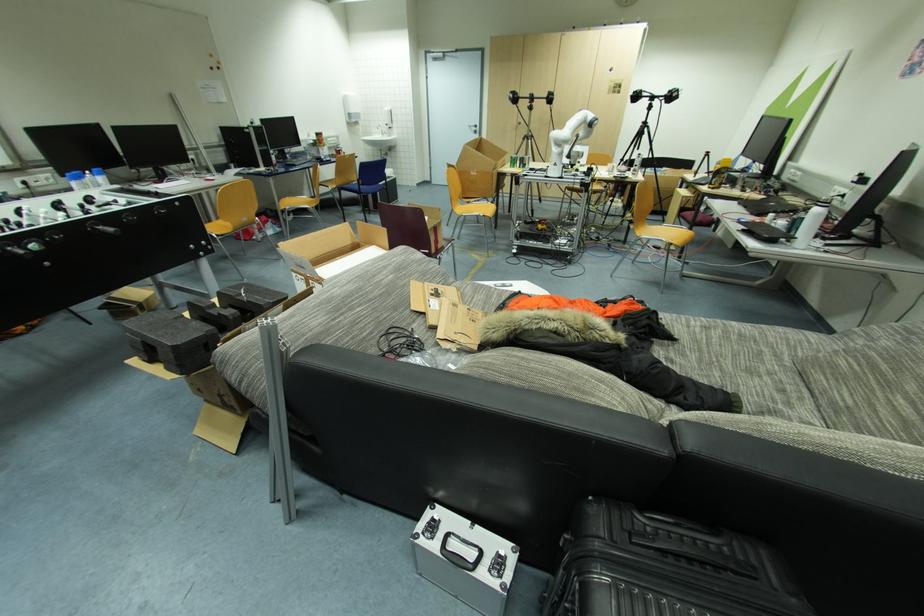
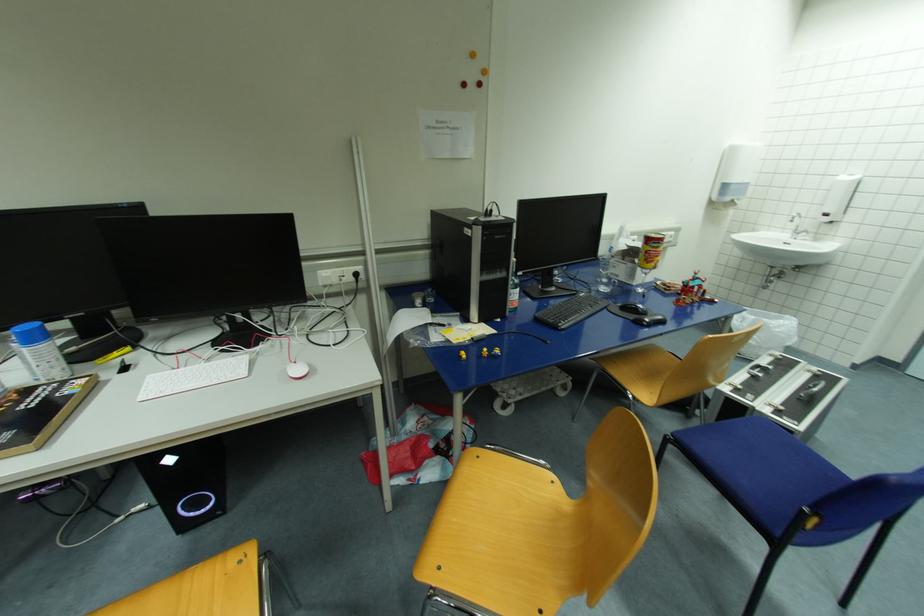
In the second image, find the point that corresponds to point 322,136 in the first image.

(653, 241)